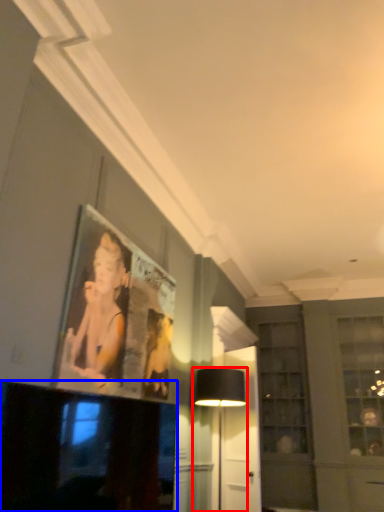
Question: Which object is further to the camera taking this photo, table lamp (highlighted by a red box) or television (highlighted by a blue box)?

Choices:
 (A) table lamp
 (B) television

Answer: (A)